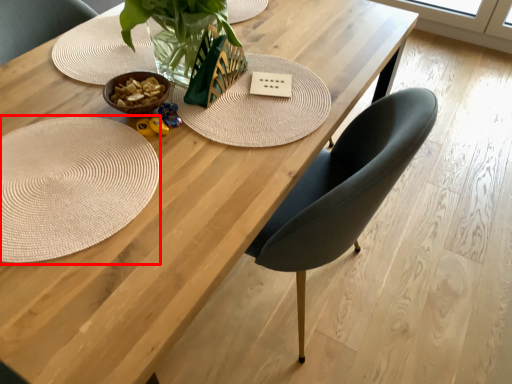
Question: Observing the image, what is the correct spatial positioning of mat (annotated by the red box) in reference to card?

Choices:
 (A) left
 (B) right

Answer: (A)